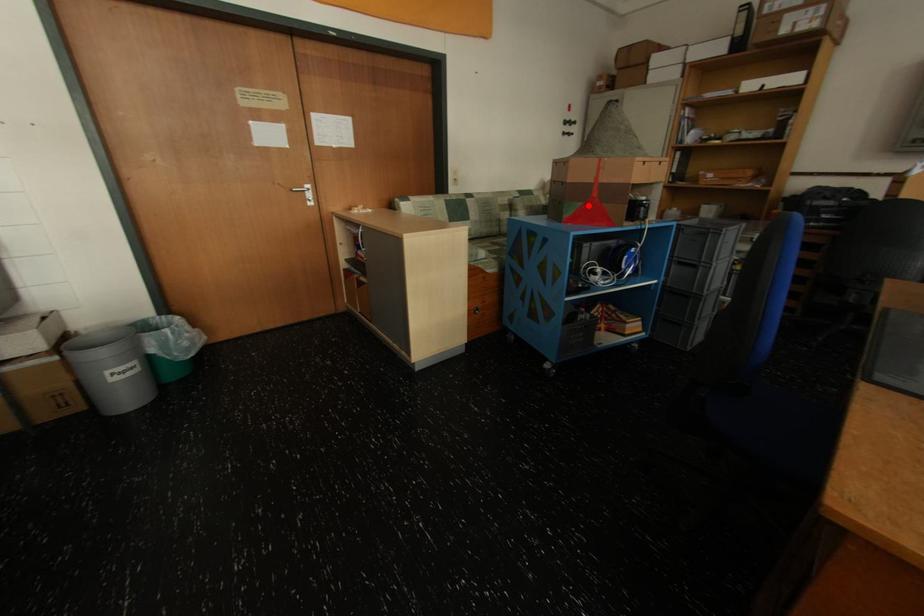
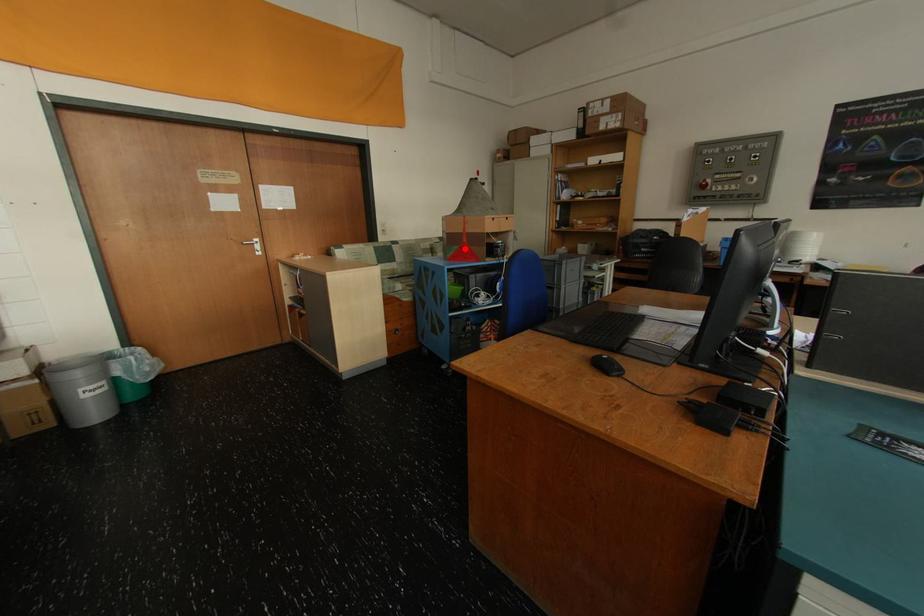
I am providing you with two images of the same scene from different viewpoints. A red point is marked on the first image and another point is marked on the second image. Does the point marked in image1 correspond to the same location as the one in image2?

Yes